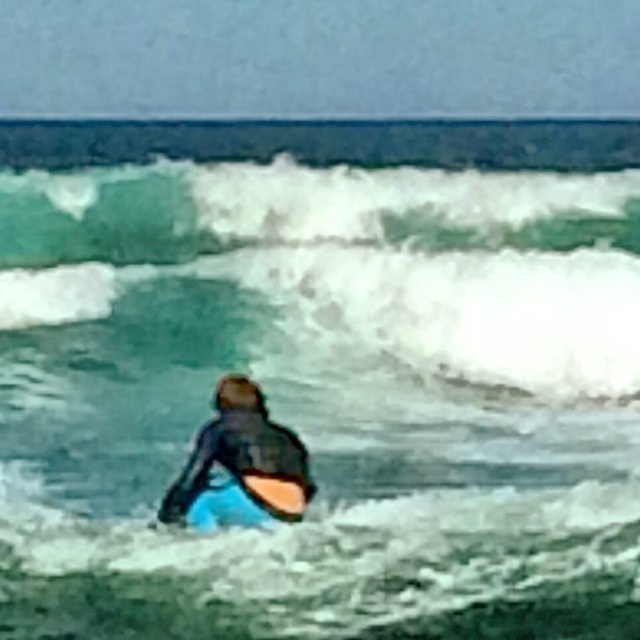
Question: Which object is the farthest from the orange foam surfboard at center?

Choices:
 (A) green translucent water at upper center
 (B) black matte wetsuit at center

Answer: (A)

Question: Does black matte wetsuit at center appear over orange foam surfboard at center?

Choices:
 (A) no
 (B) yes

Answer: (B)

Question: Which point is farther to the camera?

Choices:
 (A) (237, 460)
 (B) (381, 184)

Answer: (B)

Question: Which point appears farthest from the camera in this image?

Choices:
 (A) (262, 506)
 (B) (300, 449)
 (C) (524, 326)

Answer: (C)

Question: Can you confirm if green translucent water at upper center is smaller than black matte wetsuit at center?

Choices:
 (A) no
 (B) yes

Answer: (A)

Question: Does green translucent water at upper center appear on the right side of black matte wetsuit at center?

Choices:
 (A) yes
 (B) no

Answer: (A)